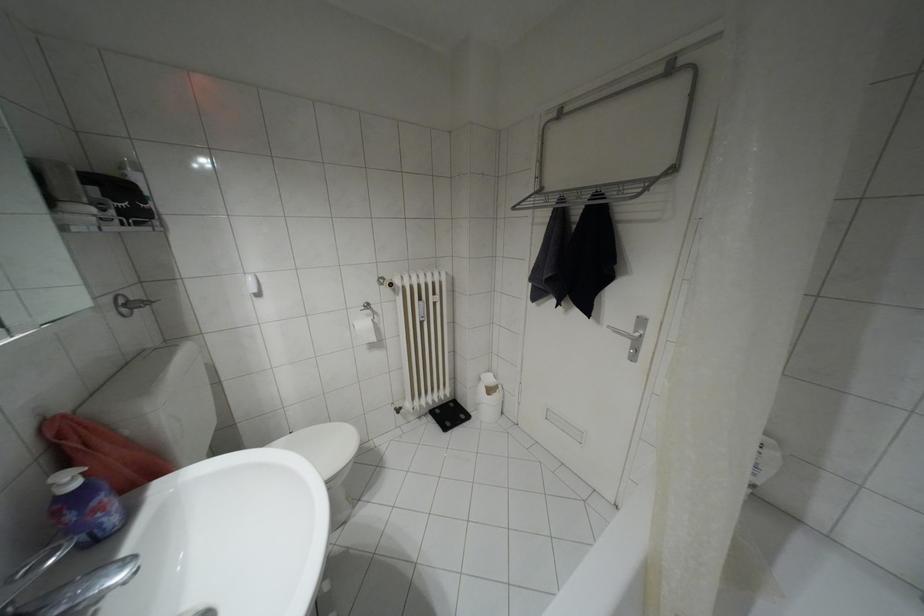
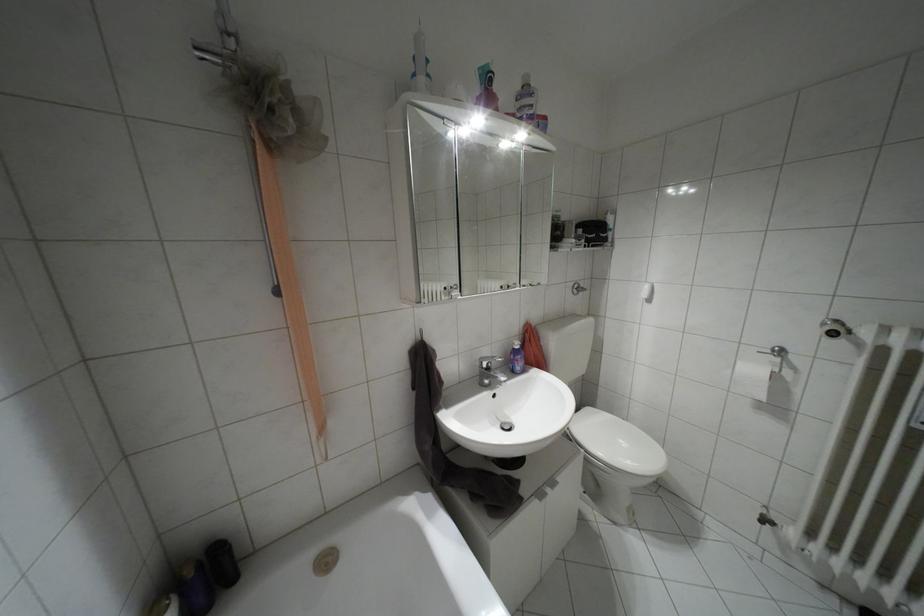
Question: How did the camera likely rotate?

Choices:
 (A) Left
 (B) Right
 (C) Up
 (D) Down

Answer: (A)